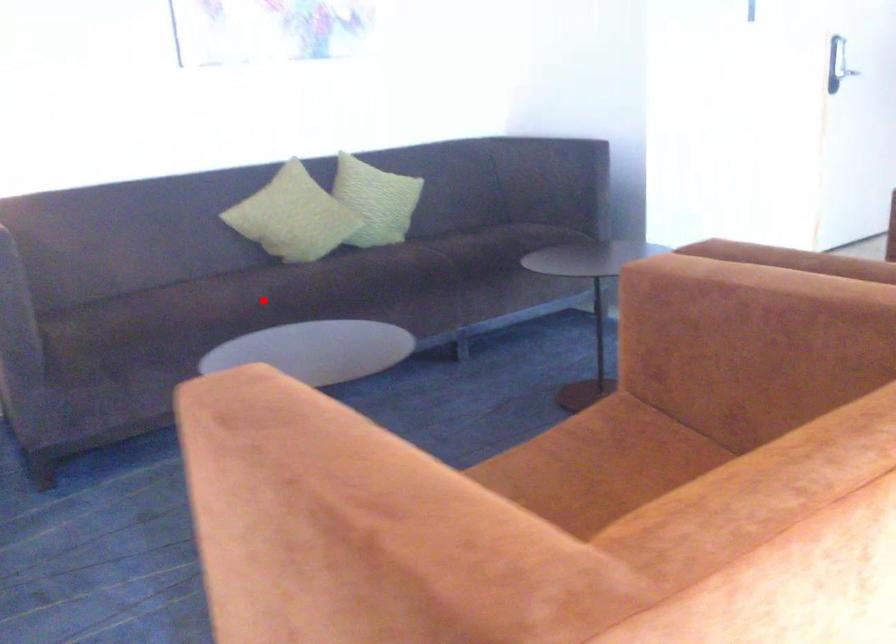
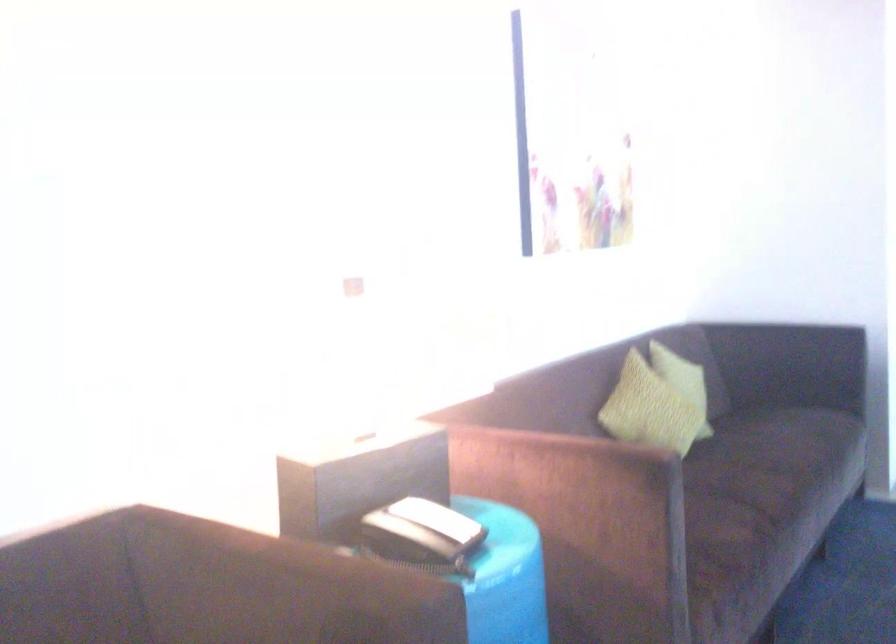
Where in the second image is the point corresponding to the highlighted location from the first image?

(768, 489)